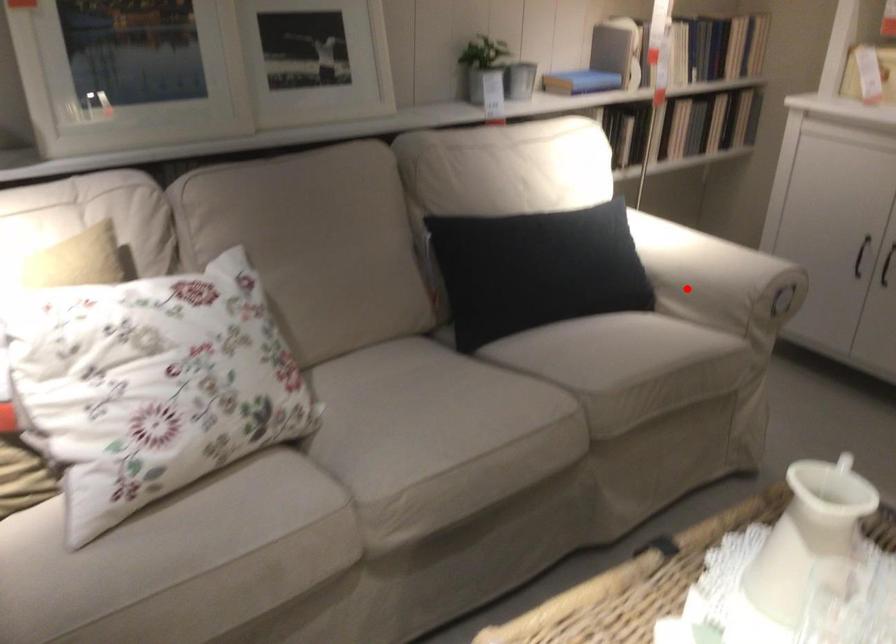
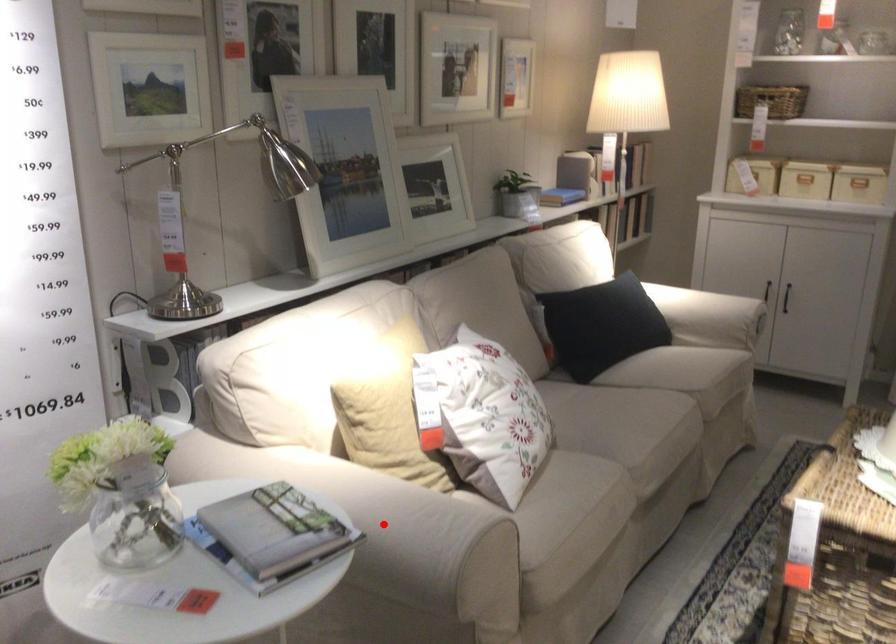
I am providing you with two images of the same scene from different viewpoints. A red point is marked on the first image and another point is marked on the second image. Does the point marked in image1 correspond to the same location as the one in image2?

No